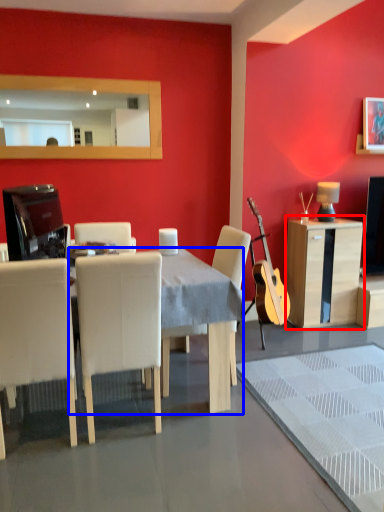
Question: Which object is further to the camera taking this photo, cabinetry (highlighted by a red box) or desk (highlighted by a blue box)?

Choices:
 (A) cabinetry
 (B) desk

Answer: (A)